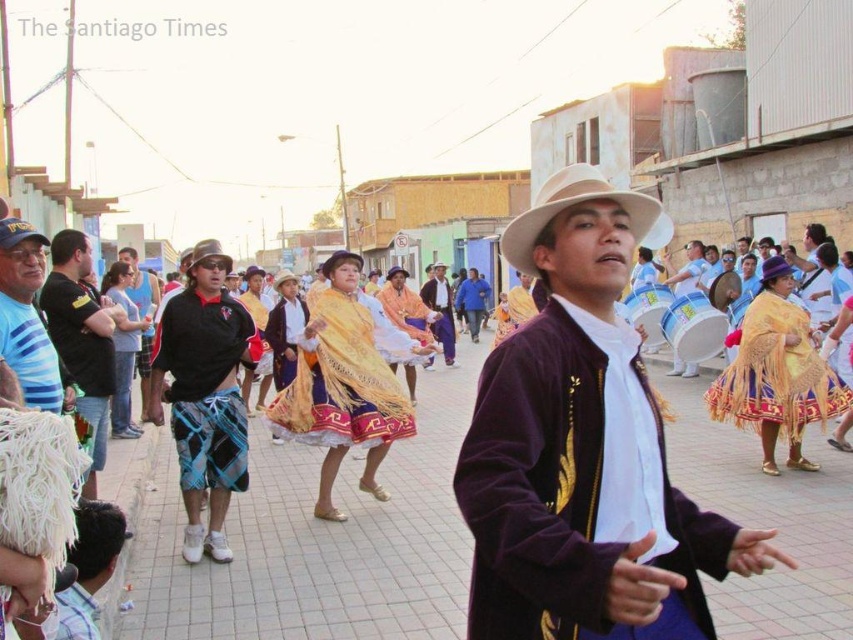
Which is more to the left, black mesh shorts at left or matte gold drum at center?

black mesh shorts at left

Is black mesh shorts at left further to camera compared to matte gold drum at center?

No, black mesh shorts at left is in front of matte gold drum at center.

Where is `black mesh shorts at left`? This screenshot has height=640, width=853. black mesh shorts at left is located at coordinates (80, 337).

Which is below, purple velvet jacket at center or plaid fabric shorts at left?

plaid fabric shorts at left is lower down.

This screenshot has height=640, width=853. What are the coordinates of `purple velvet jacket at center` in the screenshot? It's located at (583, 451).

Is purple velvet jacket at center below golden woven shawl at center?

Incorrect, purple velvet jacket at center is not positioned below golden woven shawl at center.

Which is behind, point (473, 468) or point (305, 369)?

The point (305, 369) is more distant.

Between point (468, 636) and point (380, 429), which one is positioned behind?

The point (380, 429) is behind.

Image resolution: width=853 pixels, height=640 pixels. Find the location of `purple velvet jacket at center`. purple velvet jacket at center is located at coordinates (583, 451).